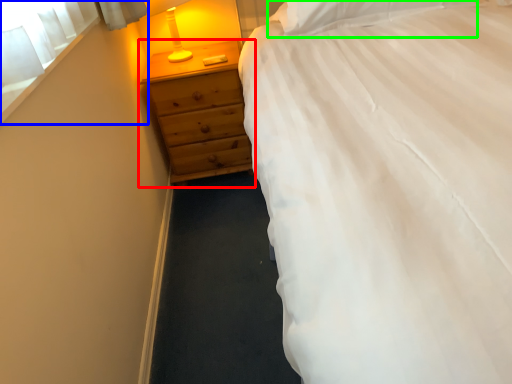
Question: Which is farther away from chest of drawers (highlighted by a red box)? window screen (highlighted by a blue box) or pillow (highlighted by a green box)?

Choices:
 (A) window screen
 (B) pillow

Answer: (A)